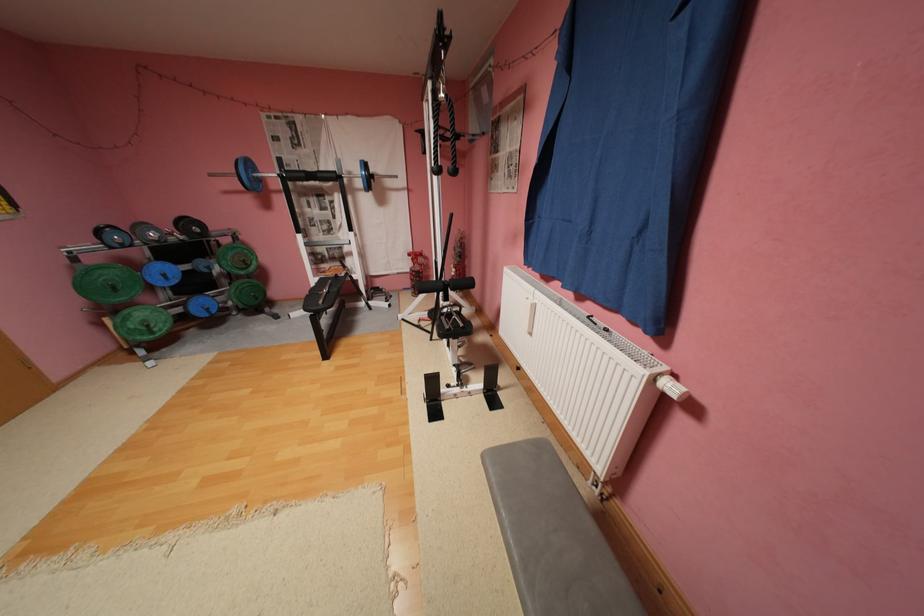
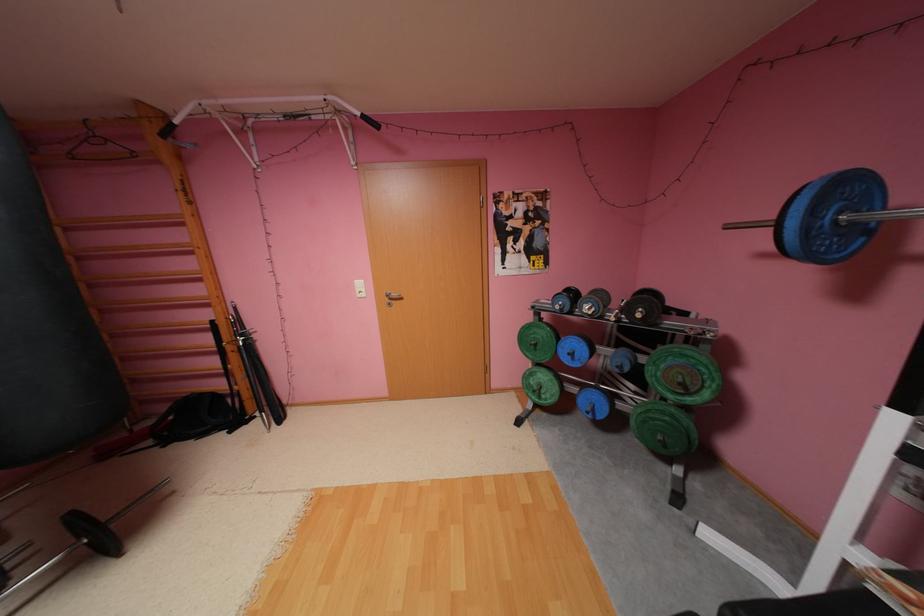
Where in the second image is the point corresponding to point 258,177 from the first image?

(816, 229)